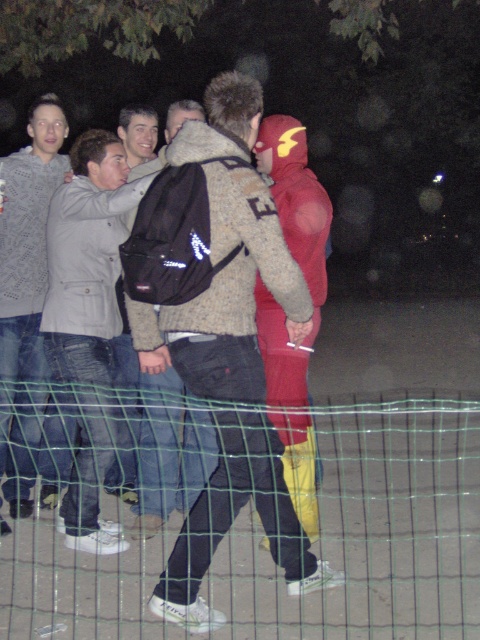
From the picture: You are a photographer trying to capture a clear shot of the black fabric backpack at center without the green mesh fence at lower center blocking the view. Based on their positions, can you position yourself to the left or right of the backpack to avoid the fence?

Since the green mesh fence at lower center is to the right of the black fabric backpack at center, you should position yourself to the right side of the backpack to avoid the fence blocking the view.

What is the object located at the coordinates point (297, 202) in the image?

The point (297, 202) indicates the red matte costume at center.